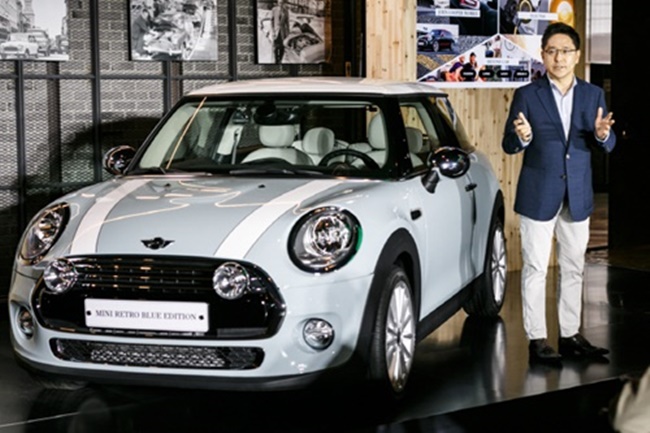
Image resolution: width=650 pixels, height=433 pixels. I want to click on wooden wall, so click(400, 50).